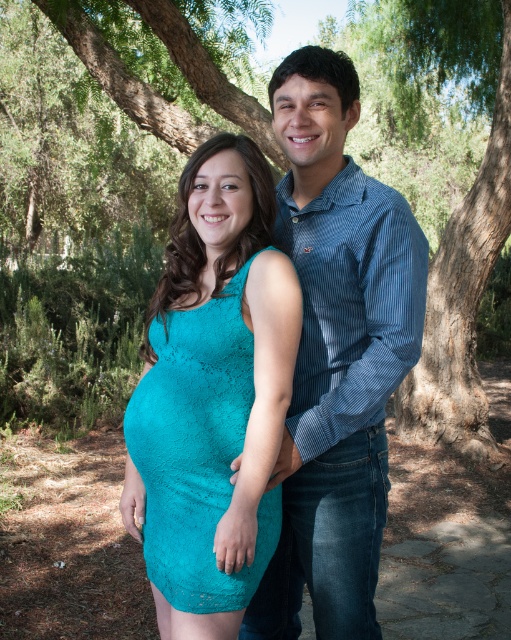
You are a photographer setting up for a couple photo shoot. You need to position a microphone stand so it won not block the couple. The stand is 1.8 meters tall. The blue striped shirt at center and teal lace dress at center are in the frame. Which object would the microphone stand be taller than?

The microphone stand at 1.8 meters would be taller than the teal lace dress at center since the blue striped shirt at center is taller than the teal lace dress at center, but the height of the blue striped shirt at center is not provided. However, since the stand is 1.8m and the dress is shorter than the shirt, if the shirt is taller than 1.8m, then the stand would not be taller than the shirt. But since we only know the shirt is taller than the dress, the stand could be taller than the dress depending on.

You are a photographer adjusting your camera to focus on two specific points in the image. The first point is at coordinate point [436,368] and the second is at point [170,387]. Which point should you focus on first if you want to capture the closest object to the camera?

Point [436,368] is closer to the viewer than point [170,387], so you should focus on point [436,368] first to capture the closest object.

You are a photographer planning to capture a closeup of the teal lace dress at center while ensuring the green leafy tree at center remains partially visible in the background. Can you fit both elements within the frame without cropping the tree?

The green leafy tree at center is wider than the teal lace dress at center, so you can position the dress centrally and include part of the tree in the background without cropping it, as the tree is wider and can be framed alongside the dress.